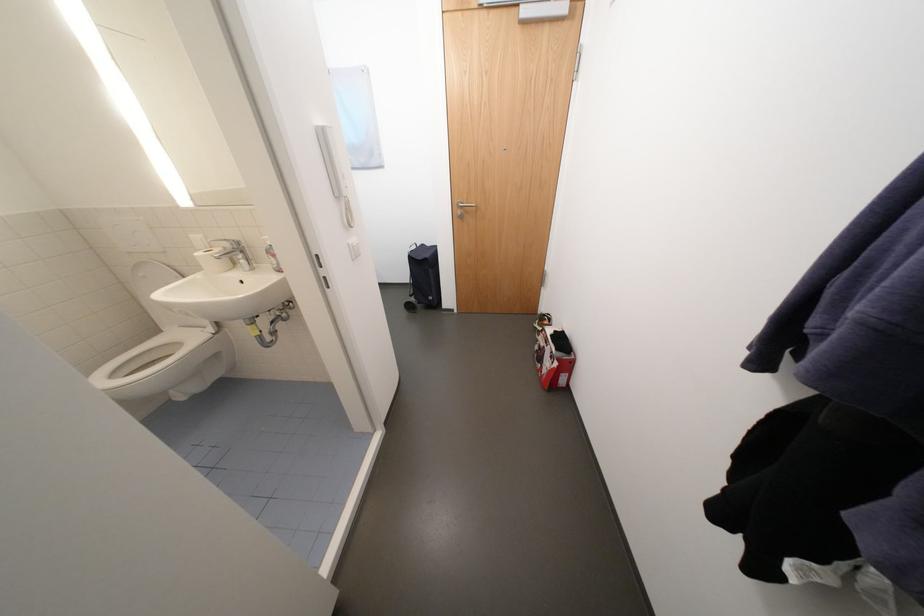
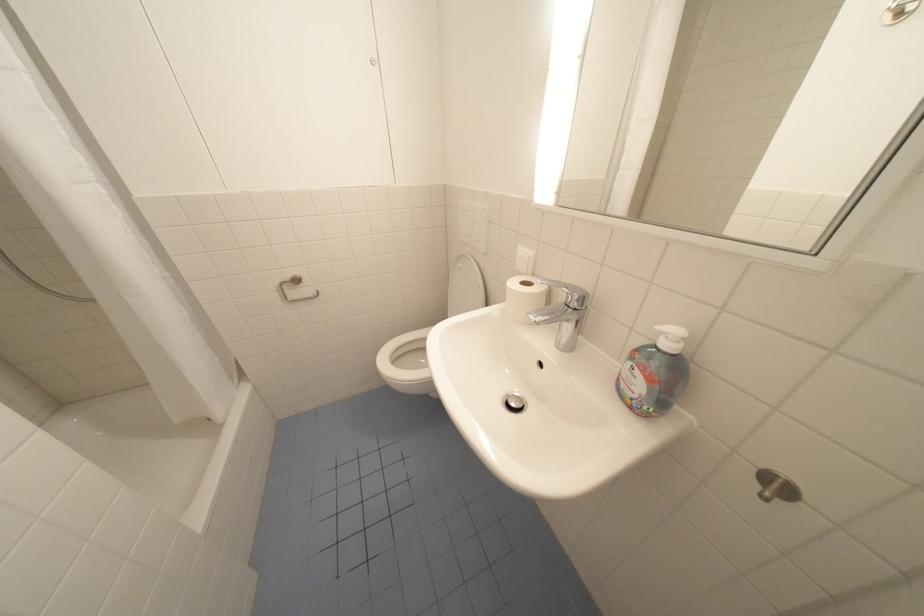
Find the pixel in the second image that matches [154,254] in the first image.

(480, 248)